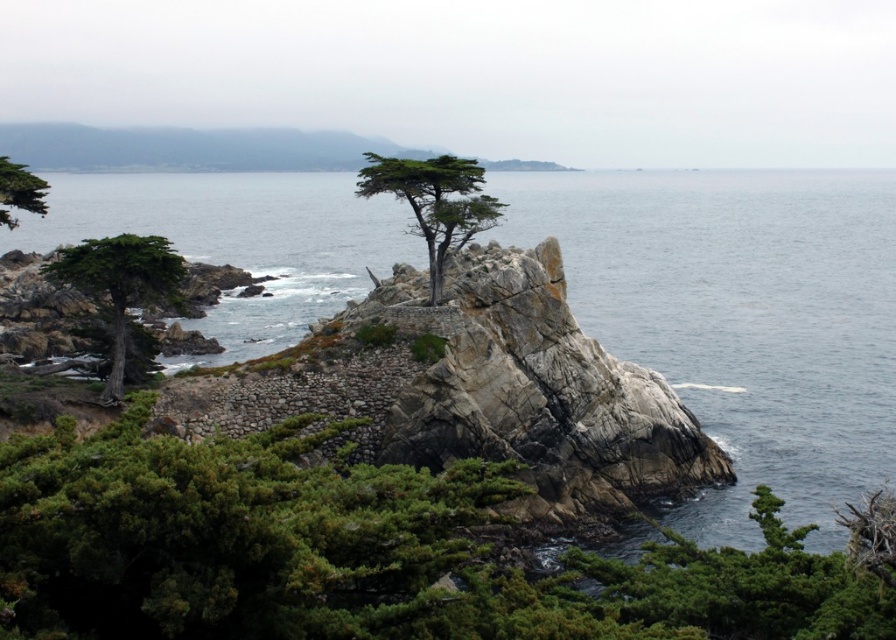
You are a photographer planning to capture the clear blue water at center and the green matte tree at upper left in a single frame. Based on the scene, which object will occupy more of the photo?

The clear blue water at center will occupy more of the photo because it is bigger than the green matte tree at upper left according to the description.

You are a hiker standing at the center of the coastal landscape. You want to take a photo of the green matte tree at left. Which direction should you face to ensure the tree is in the frame?

To capture the green matte tree at left in your photo, you should face towards the left side of the coastal landscape since the green matte tree at left is located at point coordinates (x=119, y=285).

Consider the image. You are a photographer planning to capture the entire scene in one shot. Given that the clear blue water at center and the green matte tree at left are both in your frame, which object occupies a wider area in the photo?

The clear blue water at center occupies a wider area in the photo since its width surpasses that of the green matte tree at left.